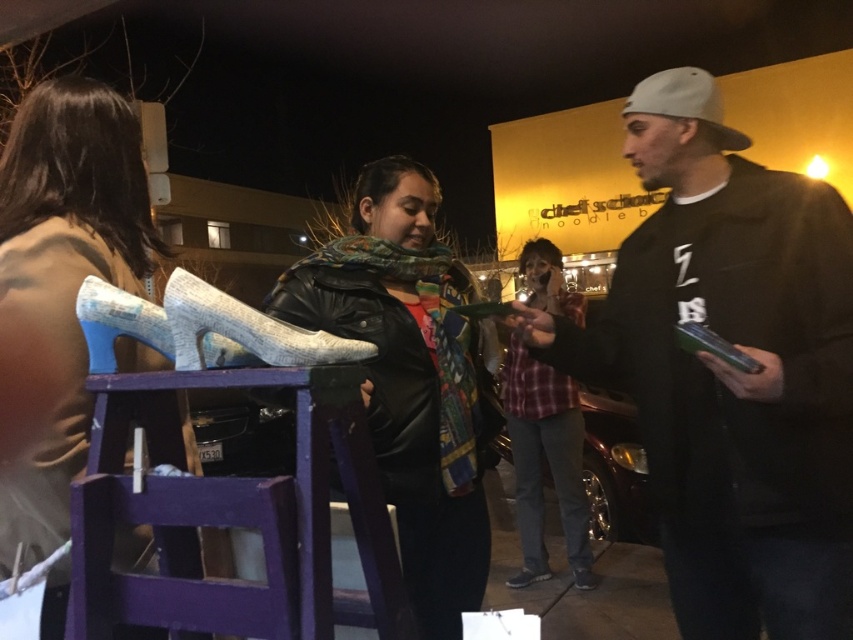
Question: Can you confirm if plaid fabric shirt at center is thinner than leather sneaker at lower center?

Choices:
 (A) no
 (B) yes

Answer: (A)

Question: Can you confirm if knitted fabric high-heeled shoe at center is positioned to the left of white fabric shoe at lower center?

Choices:
 (A) no
 (B) yes

Answer: (B)

Question: Does black matte jacket at right have a lesser width compared to matte white high-heels at left?

Choices:
 (A) yes
 (B) no

Answer: (B)

Question: Which object appears closest to the camera in this image?

Choices:
 (A) leather jacket at center
 (B) leather sneaker at lower center

Answer: (A)

Question: Which point is closer to the camera?

Choices:
 (A) plaid fabric shirt at center
 (B) white fabric shoe at lower center

Answer: (A)

Question: Which point is closer to the camera taking this photo?

Choices:
 (A) coord(531,582)
 (B) coord(554,481)

Answer: (A)